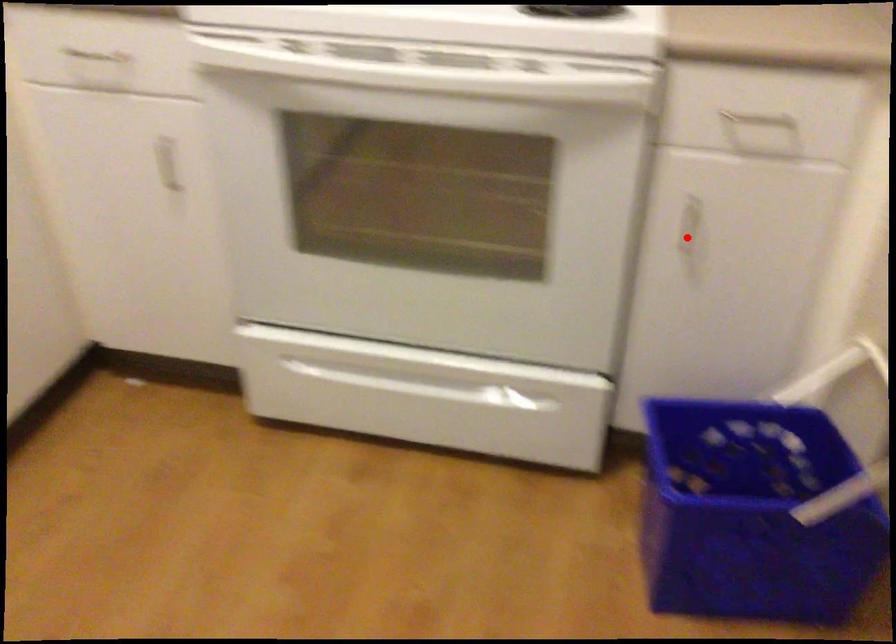
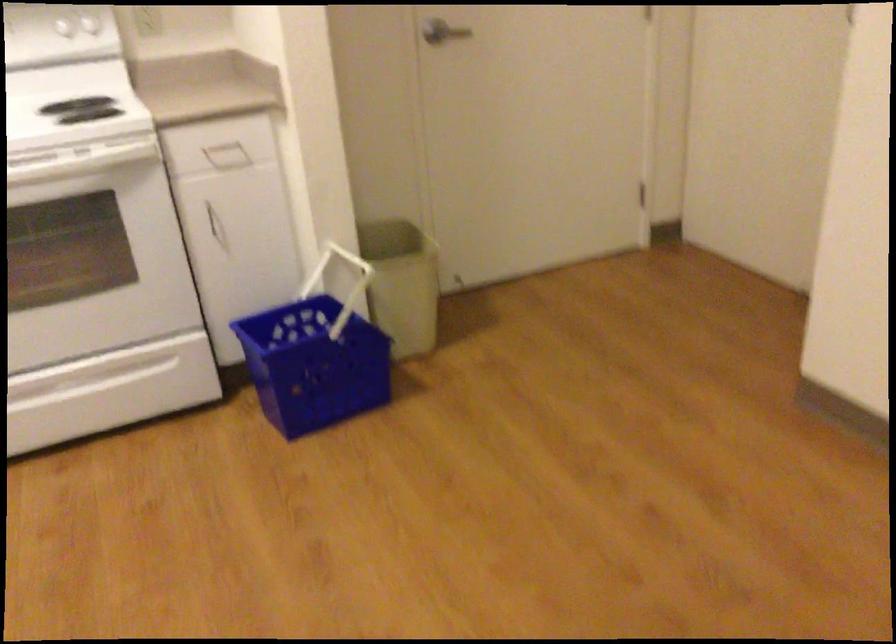
Where in the second image is the point corresponding to the highlighted location from the first image?

(216, 225)